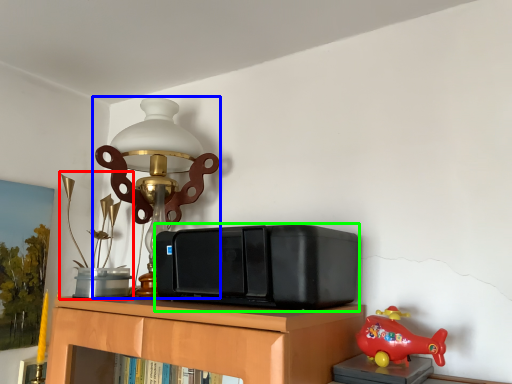
Question: Which object is positioned closest to toy (highlighted by a red box)? Select from lamp (highlighted by a blue box) and stereo (highlighted by a green box).

Choices:
 (A) lamp
 (B) stereo

Answer: (A)